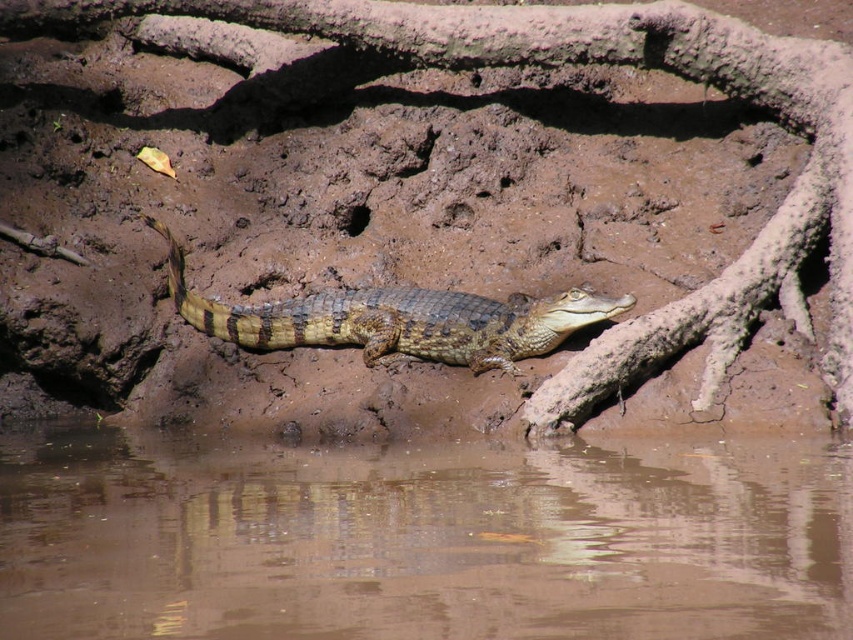
Looking at this image, you are a wildlife photographer aiming to capture the crocodile without disturbing it. You need to place a camera on either the brown muddy water at lower center or the brown mud at center. Which surface is more stable for placing the camera?

The brown mud at center is more stable because the brown muddy water at lower center is located below it, indicating it might be wetter or less solid.

You are a small animal trying to cross from the left side to the right side of the image. You need to avoid the brown scaly crocodile at center. Can you safely cross the brown muddy water at lower center without getting too close to the crocodile?

The brown muddy water at lower center is wider than the brown scaly crocodile at center, so you can cross it safely by staying away from the crocodile.

You are a wildlife photographer aiming to capture a closeup shot of the brown scaly crocodile at center. However, there is brown mud at center blocking your direct line of sight. Can you see the crocodile clearly through the mud?

The brown mud at center is above the brown scaly crocodile at center, so the crocodile is partially or fully obscured by the mud, making it difficult to see clearly.